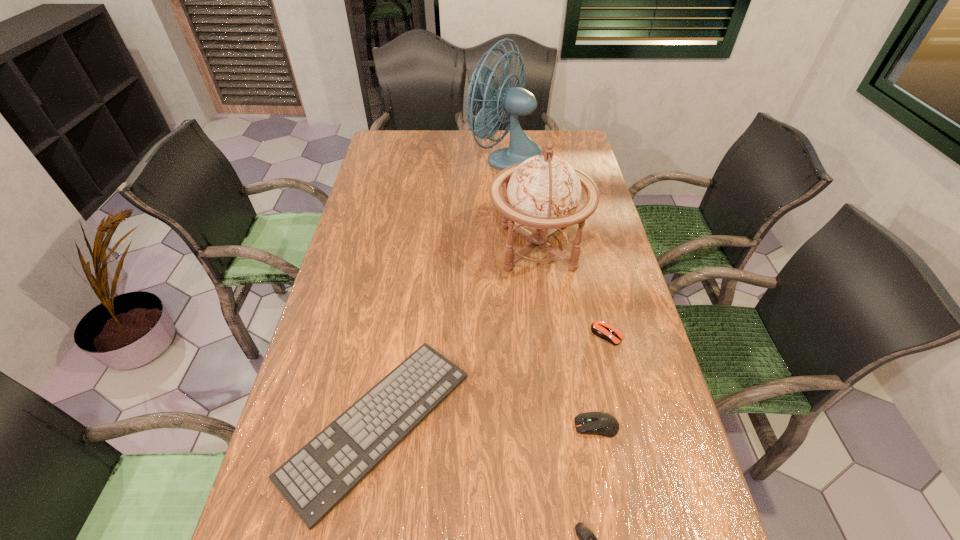
At what (x,y) coordinates should I click in order to perform the action: click on free region located in front of the tallest object to blow air. Please return your answer as a coordinate pair (x, y). This screenshot has height=540, width=960. Looking at the image, I should click on (423, 158).

At what (x,y) coordinates should I click in order to perform the action: click on blank space located 0.180m at the front of the second farthest object showing Africa. Please return your answer as a coordinate pair (x, y). Looking at the image, I should click on (432, 247).

The image size is (960, 540). I want to click on vacant region located at the front of the second farthest object showing Africa, so 439,247.

This screenshot has height=540, width=960. I want to click on vacant space located at the front of the second farthest object showing Africa, so click(x=417, y=247).

Find the location of `vacant region located on the button of the tallest mouse`. vacant region located on the button of the tallest mouse is located at coordinates [423, 426].

You are a GUI agent. You are given a task and a screenshot of the screen. Output one action in this format:
    pyautogui.click(x=<x>, y=<y>)
    Task: Click on the free location located 0.080m on the button of the tallest mouse
    This screenshot has width=960, height=540.
    Given the screenshot: What is the action you would take?
    pyautogui.click(x=539, y=426)

Image resolution: width=960 pixels, height=540 pixels. Find the location of `vacant area situated 0.130m on the button of the tallest mouse`. vacant area situated 0.130m on the button of the tallest mouse is located at coordinates (516, 426).

In order to click on vacant space located on the right of the computer keyboard in this screenshot , I will do `click(489, 424)`.

Where is `vacant area situated 0.060m on the front of the farthest mouse`? vacant area situated 0.060m on the front of the farthest mouse is located at coordinates (614, 366).

I want to click on object that is at the far edge, so pos(513,101).